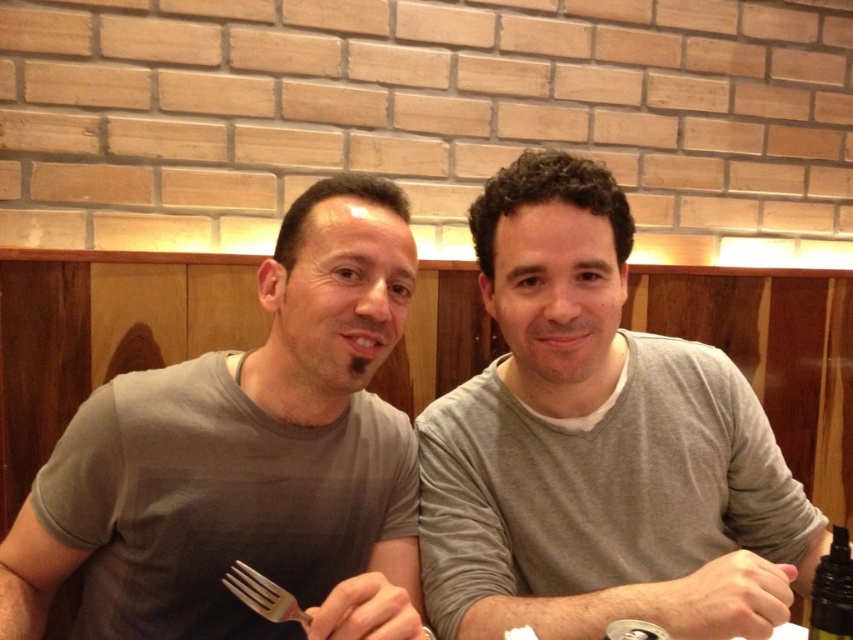
Is gray matte t-shirt at center in front of silver metallic fork at lower center?

Yes, gray matte t-shirt at center is in front of silver metallic fork at lower center.

Locate an element on the screen. gray matte t-shirt at center is located at coordinates (247, 458).

Locate an element on the screen. gray matte t-shirt at center is located at coordinates (247, 458).

Between gray cotton shirt at center and silver metallic fork at lower center, which one appears on the right side from the viewer's perspective?

Positioned to the right is gray cotton shirt at center.

Is point (579, 465) in front of point (250, 588)?

No.

Where is `gray cotton shirt at center`? The image size is (853, 640). gray cotton shirt at center is located at coordinates (596, 445).

Can you confirm if gray cotton shirt at center is wider than gray matte t-shirt at center?

Yes.

Can you confirm if gray cotton shirt at center is smaller than gray matte t-shirt at center?

No.

Find the location of a particular element. gray cotton shirt at center is located at coordinates (596, 445).